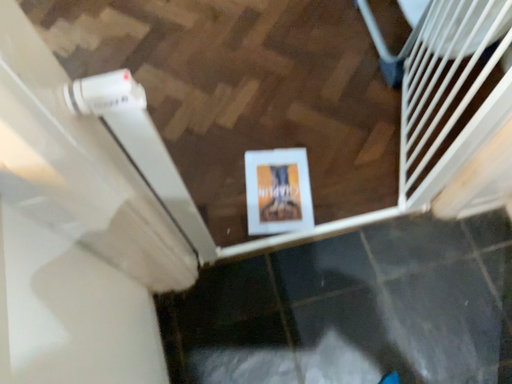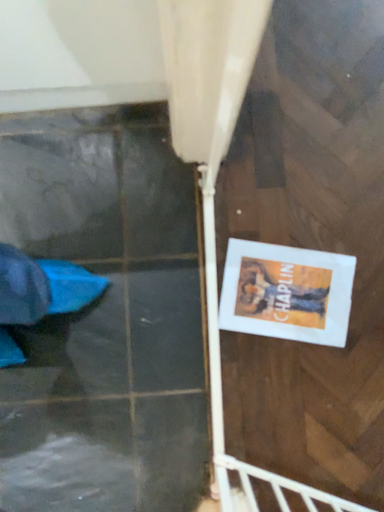
Question: Which way did the camera rotate in the video?

Choices:
 (A) rotated left
 (B) rotated right

Answer: (A)